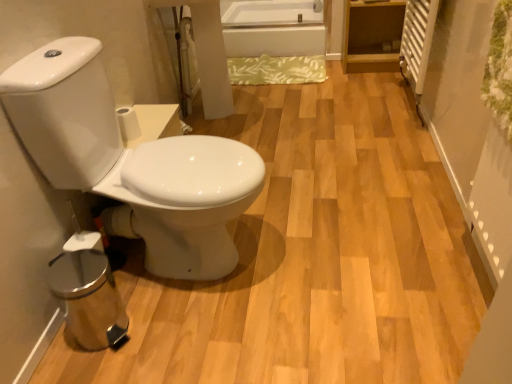
Question: Visually, is white matte toilet paper at center positioned to the left or to the right of white glossy toilet at left?

Choices:
 (A) right
 (B) left

Answer: (B)

Question: Considering the positions of point [136, 129] and point [204, 226], is point [136, 129] closer or farther from the camera than point [204, 226]?

Choices:
 (A) closer
 (B) farther

Answer: (B)

Question: Which object is positioned closest to the white glossy bathtub at upper center?

Choices:
 (A) white matte toilet paper at center
 (B) white glossy toilet at left

Answer: (A)

Question: Which object is the closest to the white glossy bathtub at upper center?

Choices:
 (A) white glossy toilet at left
 (B) white matte toilet paper at center

Answer: (B)